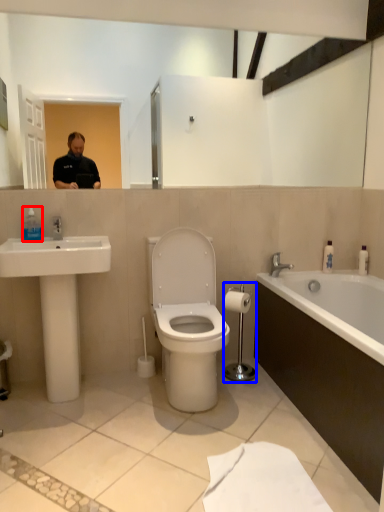
Question: Which point is closer to the camera, soap dispenser (highlighted by a red box) or towel bar (highlighted by a blue box)?

Choices:
 (A) soap dispenser
 (B) towel bar

Answer: (A)